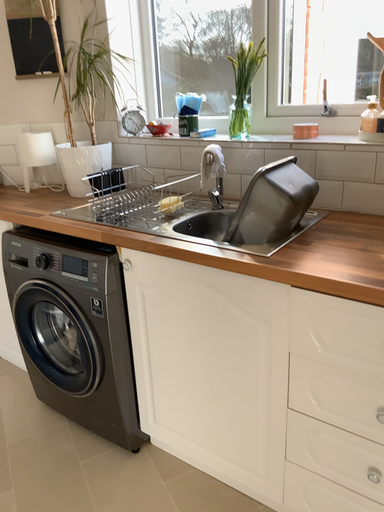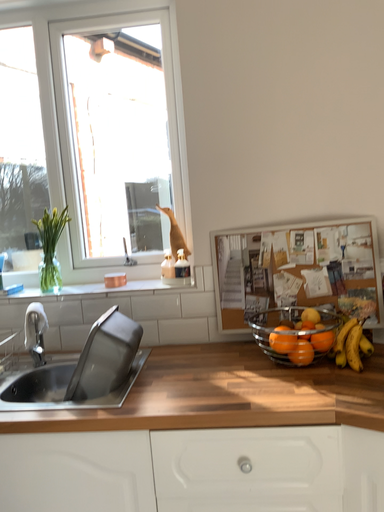
Question: How did the camera likely rotate when shooting the video?

Choices:
 (A) rotated right
 (B) rotated left

Answer: (A)